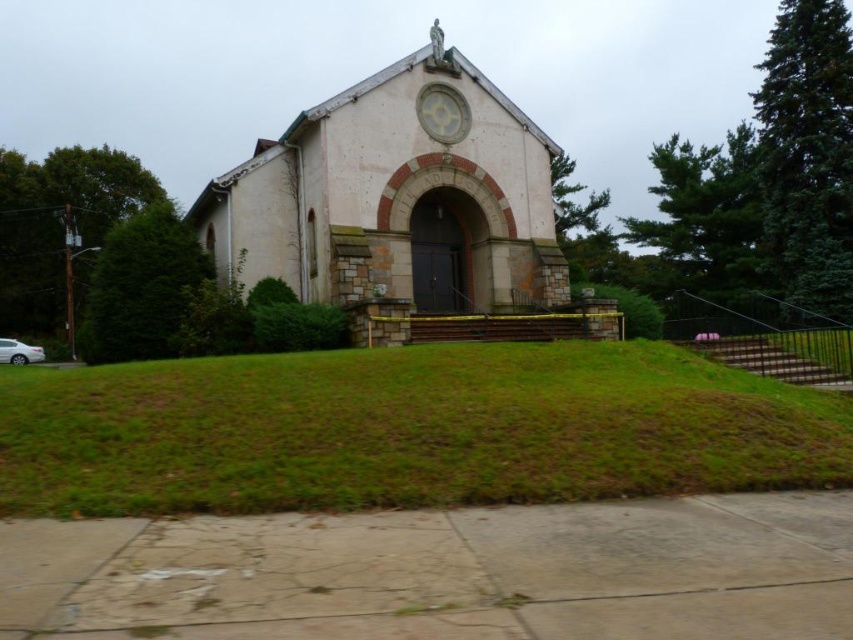
You are a visitor arriving at the white stone church at center and notice a car parked nearby. Which side of the church is the white glossy sedan at lower left located?

The white glossy sedan at lower left is located to the left side of the white stone church at center because the church is to the right of the sedan.

You are a visitor approaching the building and notice the green grass at center and the white glossy sedan at lower left. Which object is closer to the building?

The green grass at center is closer to the building because it is positioned over the white glossy sedan at lower left, indicating it is in front of the sedan and thus nearer to the visitor.

You are a visitor approaching the white stone church at center and the white glossy sedan at lower left. From your perspective, which object is closer to the entrance of the building?

The white stone church at center is positioned over the white glossy sedan at lower left, so the church is closer to the entrance than the sedan.